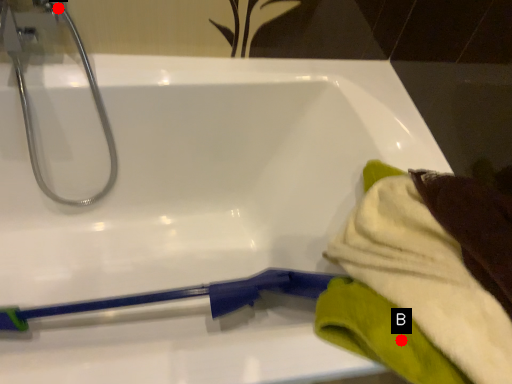
Question: Two points are circled on the image, labeled by A and B beside each circle. Which point is closer to the camera taking this photo?

Choices:
 (A) A is closer
 (B) B is closer

Answer: (B)